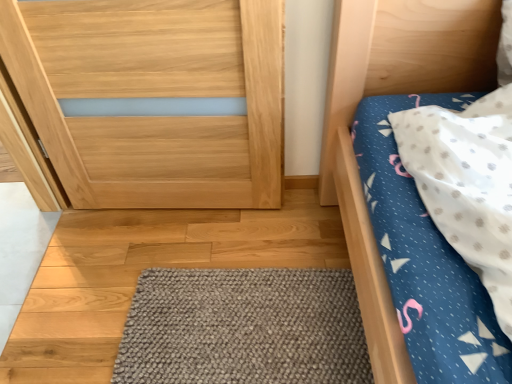
Locate an element on the screen. The height and width of the screenshot is (384, 512). natural wood door at upper left is located at coordinates (154, 97).

What do you see at coordinates (154, 97) in the screenshot? This screenshot has width=512, height=384. I see `natural wood door at upper left` at bounding box center [154, 97].

Locate an element on the screen. natural wood door at upper left is located at coordinates (154, 97).